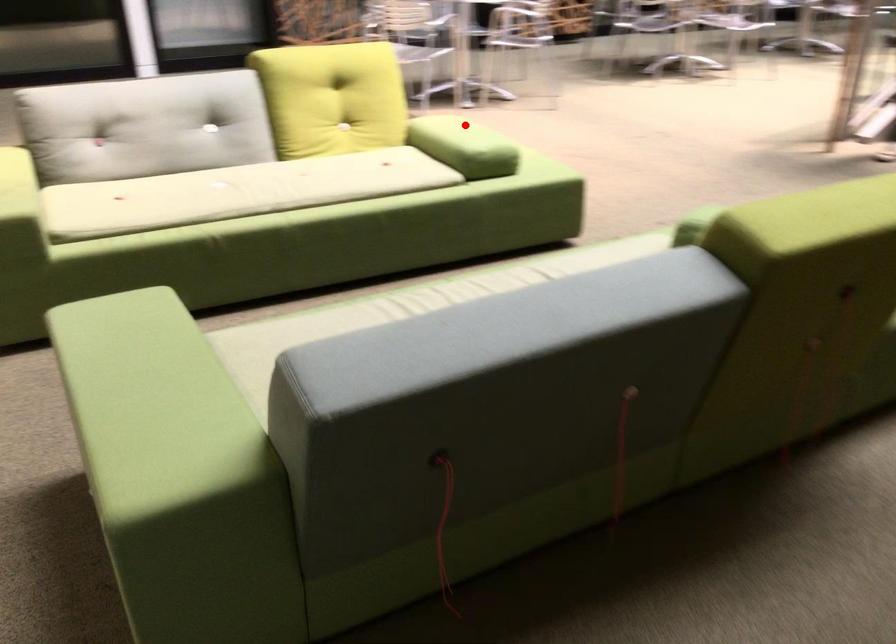
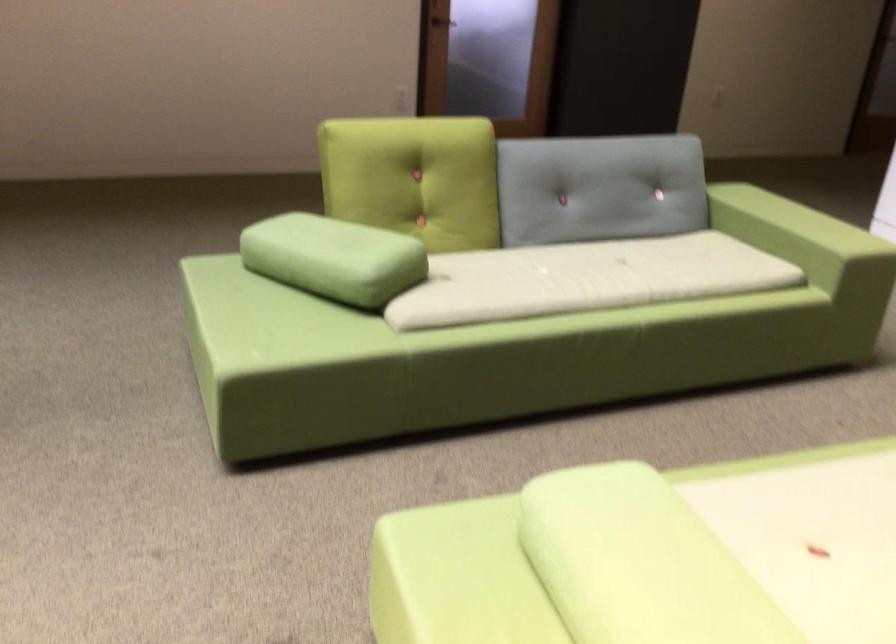
Question: A red point is marked in image1. In image2, is the corresponding 3D point closer to the camera or farther? Reply with the corresponding letter.

Choices:
 (A) The corresponding 3D point is closer.
 (B) The corresponding 3D point is farther.

Answer: (A)